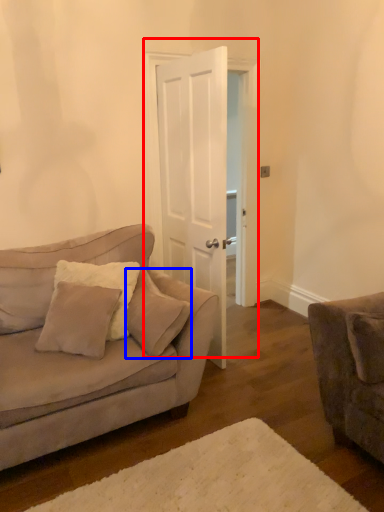
Question: Which of the following is the farthest to the observer, door (highlighted by a red box) or pillow (highlighted by a blue box)?

Choices:
 (A) door
 (B) pillow

Answer: (A)